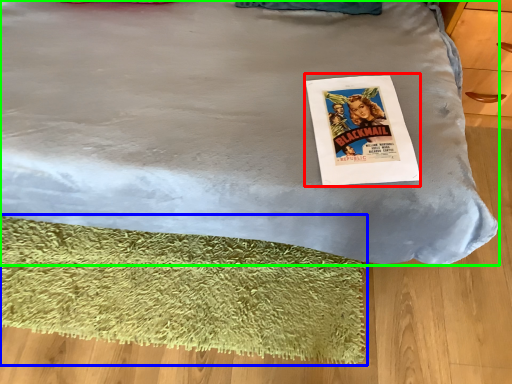
Question: Estimate the real-world distances between objects in this image. Which object is farther from magazine (highlighted by a red box), mat (highlighted by a blue box) or bed (highlighted by a green box)?

Choices:
 (A) mat
 (B) bed

Answer: (A)